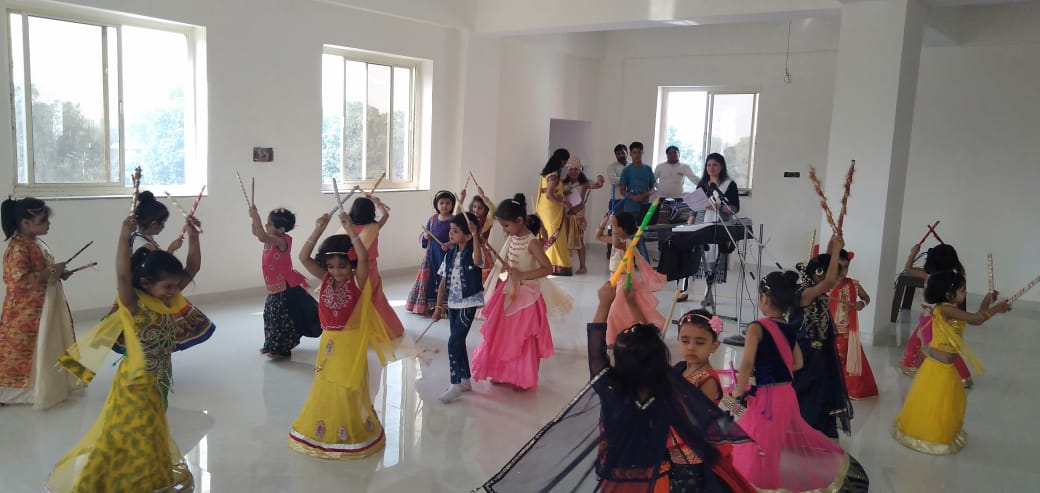
Image resolution: width=1040 pixels, height=493 pixels. In order to click on wall in this screenshot , I will do `click(508, 126)`.